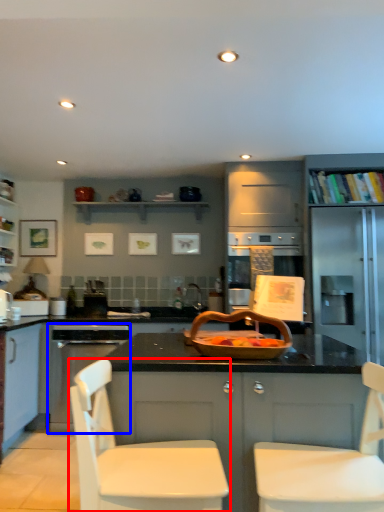
Question: Among these objects, which one is nearest to the camera, chair (highlighted by a red box) or kitchen appliance (highlighted by a blue box)?

Choices:
 (A) chair
 (B) kitchen appliance

Answer: (A)